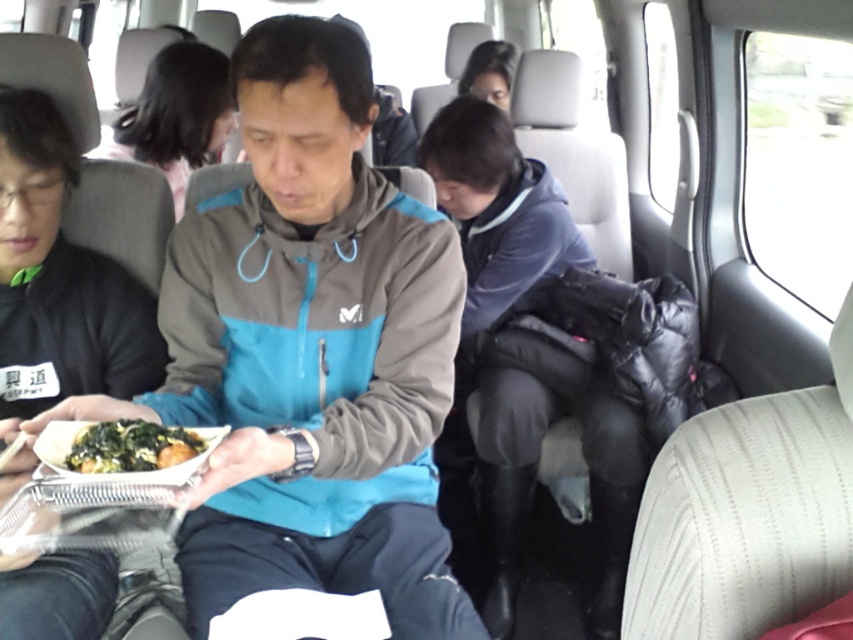
Question: Which point appears farthest from the camera in this image?

Choices:
 (A) (496, 93)
 (B) (73, 564)
 (C) (170, 124)
 (D) (73, 460)

Answer: (A)

Question: Does green leafy vegetables at center appear over smooth black hair at upper center?

Choices:
 (A) yes
 (B) no

Answer: (B)

Question: Observing the image, what is the correct spatial positioning of black matte jacket at left in reference to smooth black hair at upper center?

Choices:
 (A) left
 (B) right

Answer: (A)

Question: Which point is closer to the camera?

Choices:
 (A) black matte hair at upper center
 (B) black matte jacket at left
 (C) green leafy vegetables at center
 (D) smooth black hair at upper center

Answer: (C)

Question: Is black matte jacket at left bigger than black matte hair at upper center?

Choices:
 (A) no
 (B) yes

Answer: (A)

Question: Among these objects, which one is farthest from the camera?

Choices:
 (A) black matte jacket at left
 (B) green leafy vegetables at center
 (C) black matte hair at upper center

Answer: (C)